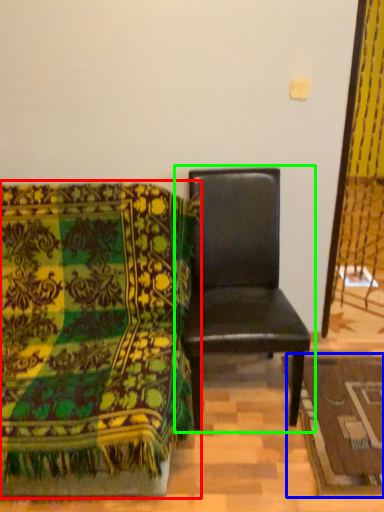
Question: Estimate the real-world distances between objects in this image. Which object is farther from chair (highlighted by a red box), mat (highlighted by a blue box) or chair (highlighted by a green box)?

Choices:
 (A) mat
 (B) chair

Answer: (A)